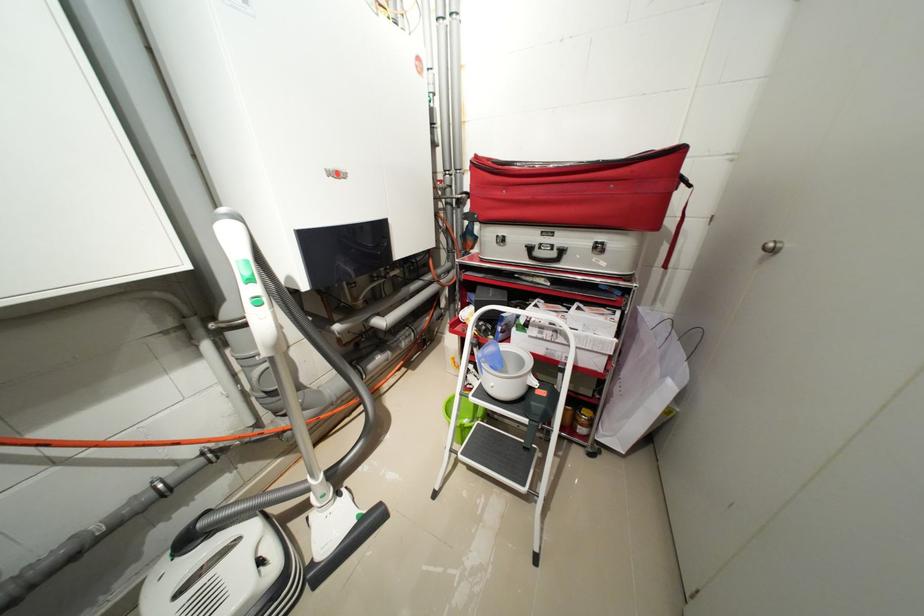
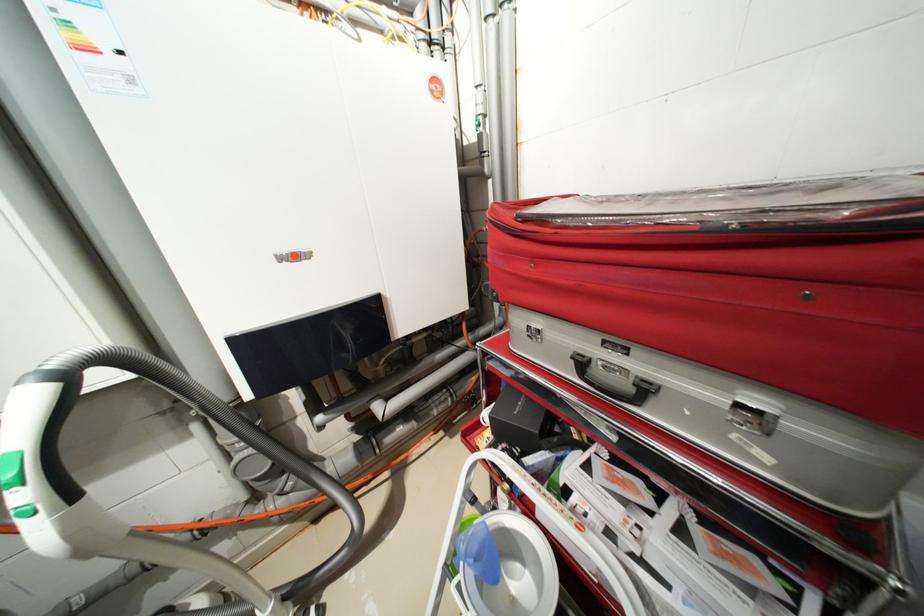
Question: I am providing you with two images of the same scene from different viewpoints. Which of the following objects are not visible in image2?

Choices:
 (A) green vacuum button
 (B) vacuum cleaner handle
 (C) blue plastic handle
 (D) none of these

Answer: (D)